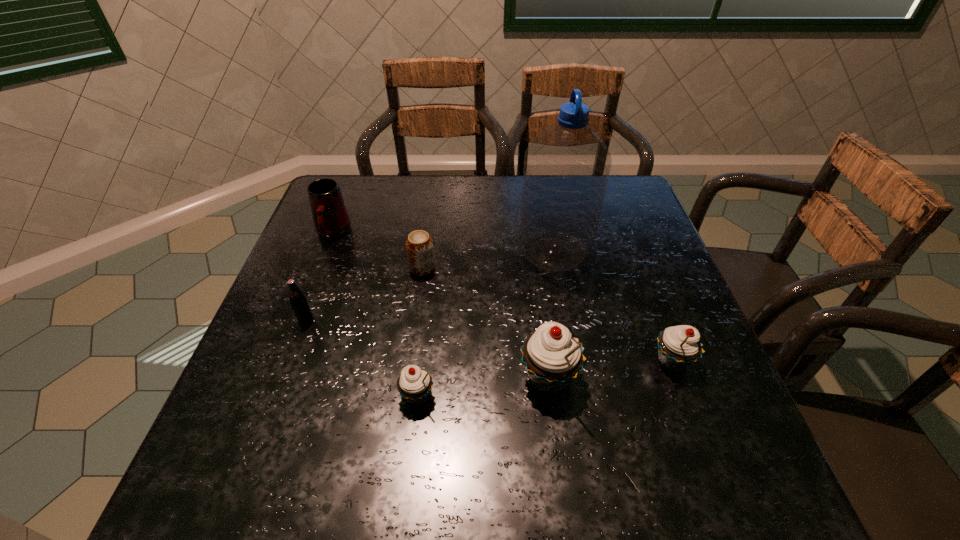
This screenshot has height=540, width=960. Identify the location of cupcake that is the nearest to the tallest object. (678, 346).

Locate an element on the screen. The height and width of the screenshot is (540, 960). blank space that satisfies the following two spatial constraints: 1. on the back side of the water jug; 2. on the left side of the beer can is located at coordinates (424, 252).

Locate an element on the screen. The width and height of the screenshot is (960, 540). free point that satisfies the following two spatial constraints: 1. on the side of the rightmost object with the handle; 2. on the right side of the mug is located at coordinates (284, 361).

Where is `free space that satisfies the following two spatial constraints: 1. on the back side of the beer can; 2. on the right side of the tallest object`? Image resolution: width=960 pixels, height=540 pixels. free space that satisfies the following two spatial constraints: 1. on the back side of the beer can; 2. on the right side of the tallest object is located at coordinates (424, 252).

This screenshot has height=540, width=960. In order to click on vacant space that satisfies the following two spatial constraints: 1. on the side of the mug with the handle; 2. on the left side of the water jug in this screenshot , I will do `click(326, 252)`.

What are the coordinates of `free spot that satisfies the following two spatial constraints: 1. on the side of the mug with the handle; 2. on the left side of the leftmost cupcake` in the screenshot? It's located at point(271,396).